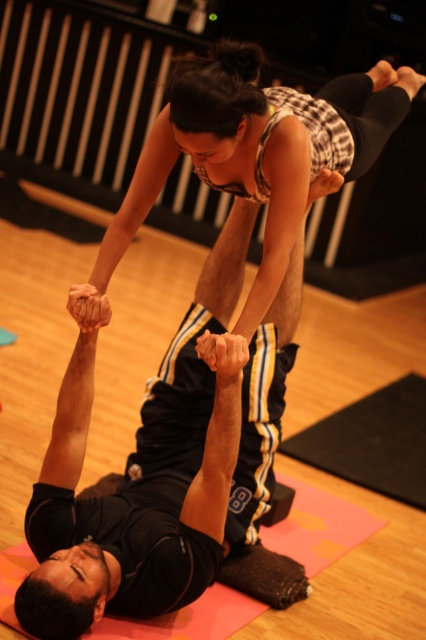
Question: Can you confirm if black matte yoga mat at upper center is positioned to the left of matte black tank top at upper center?

Choices:
 (A) no
 (B) yes

Answer: (B)

Question: Which point is closer to the camera taking this photo?

Choices:
 (A) (201, 157)
 (B) (83, 627)

Answer: (B)

Question: In this image, where is black matte yoga mat at upper center located relative to matte black tank top at upper center?

Choices:
 (A) above
 (B) below

Answer: (B)

Question: Among these objects, which one is farthest from the camera?

Choices:
 (A) matte black tank top at upper center
 (B) black matte yoga mat at upper center

Answer: (B)

Question: Does black matte yoga mat at upper center come behind matte black tank top at upper center?

Choices:
 (A) no
 (B) yes

Answer: (B)

Question: Among these objects, which one is nearest to the camera?

Choices:
 (A) matte black tank top at upper center
 (B) black matte yoga mat at upper center

Answer: (A)